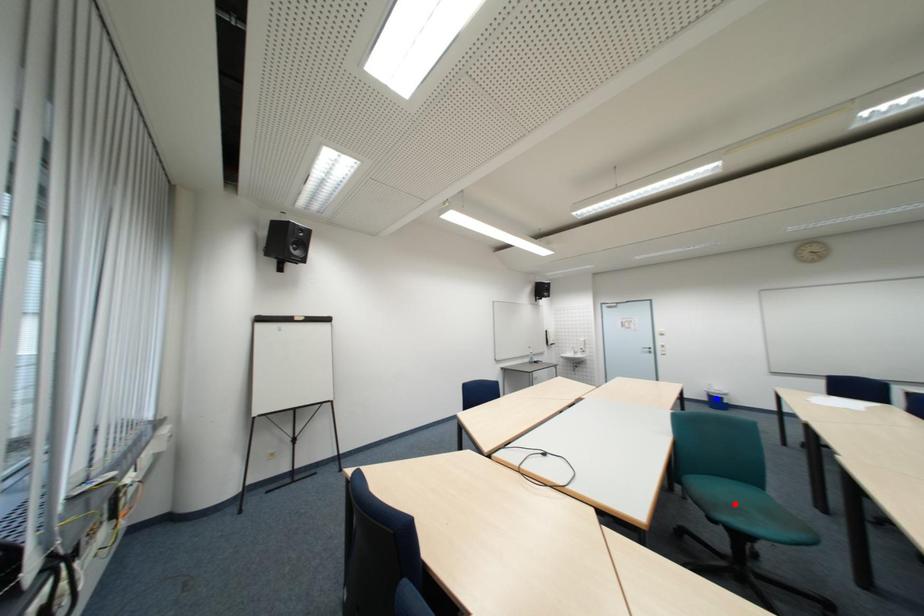
Question: In the image, two points are highlighted. Which point is nearer to the camera? Reply with the corresponding letter.

Choices:
 (A) blue point
 (B) red point

Answer: (B)